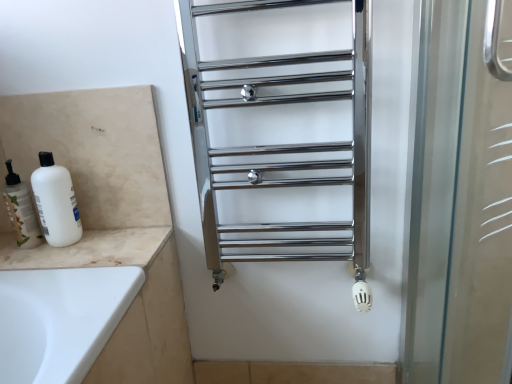
The image size is (512, 384). I want to click on free location in front of white matte bottle at left, so click(24, 258).